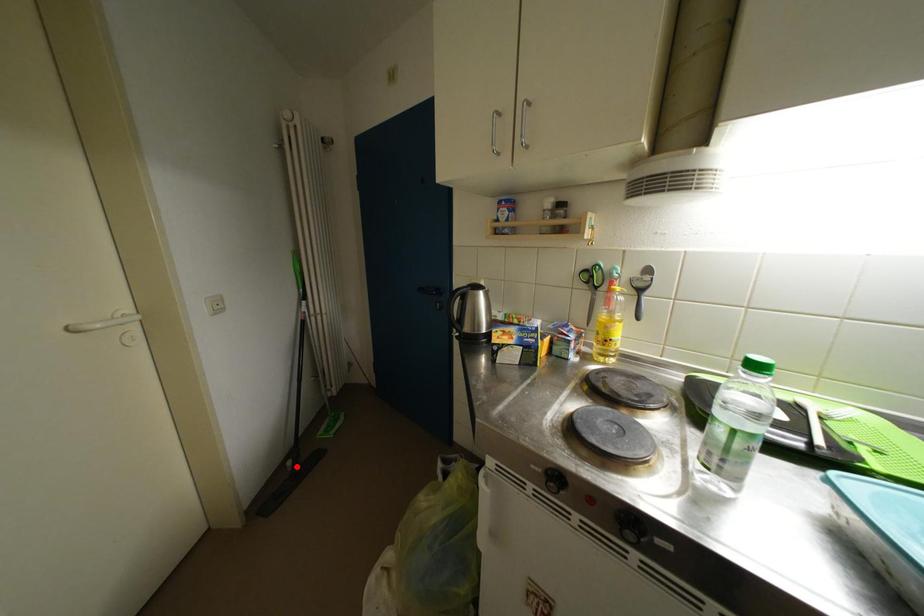
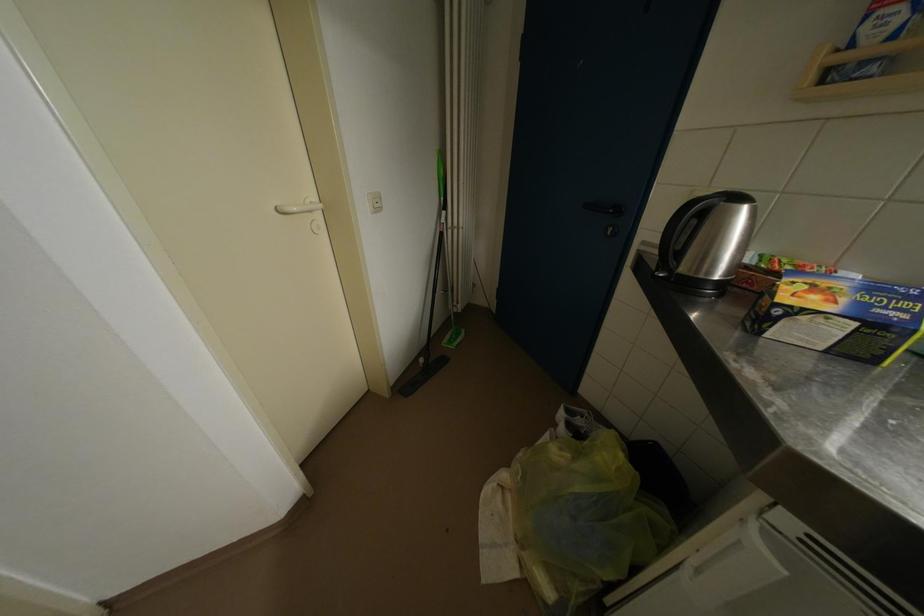
Locate, in the second image, the point that corresponds to the highlighted location in the first image.

(429, 363)